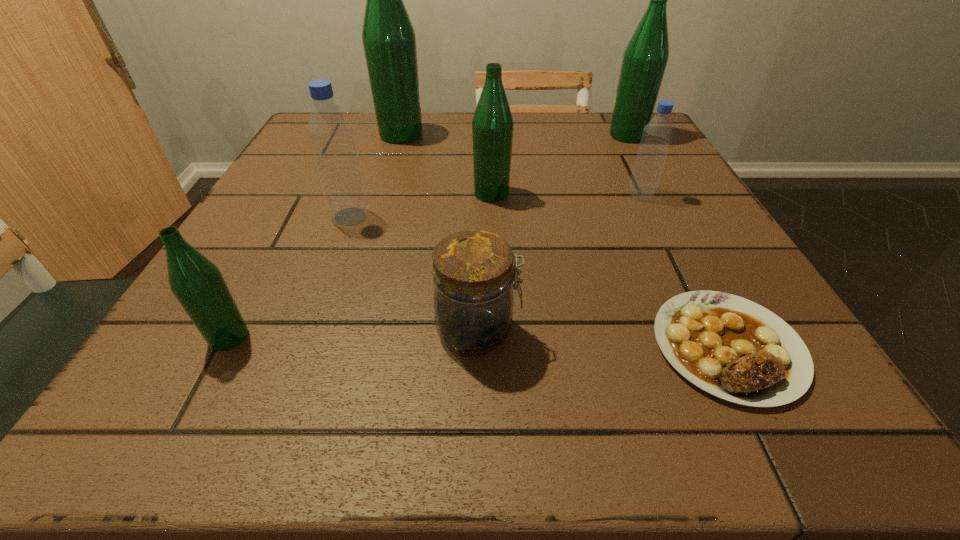
At what (x,y) coordinates should I click in order to perform the action: click on the nearest green bottle. Please return your answer as a coordinate pair (x, y). This screenshot has height=540, width=960. Looking at the image, I should click on (197, 283).

The width and height of the screenshot is (960, 540). Find the location of `the smallest green bottle`. the smallest green bottle is located at coordinates (197, 283).

Find the location of `jar`. jar is located at coordinates (473, 273).

The height and width of the screenshot is (540, 960). Find the location of `the shortest object`. the shortest object is located at coordinates (735, 349).

The height and width of the screenshot is (540, 960). I want to click on blank space located 0.170m on the left of the second green bottle from left to right, so click(x=306, y=135).

Find the location of a particular element. vacant space situated 0.050m on the left of the third smallest green bottle is located at coordinates (587, 136).

The height and width of the screenshot is (540, 960). In order to click on free spot located 0.150m on the left of the second nearest green bottle in this screenshot , I will do pyautogui.click(x=396, y=193).

You are a GUI agent. You are given a task and a screenshot of the screen. Output one action in this format:
    pyautogui.click(x=<x>, y=<y>)
    Task: Click on the vacant space situated on the right of the nearer blue bottle
    Image resolution: width=960 pixels, height=540 pixels.
    Given the screenshot: What is the action you would take?
    pyautogui.click(x=481, y=217)

Find the location of a particular element. Image resolution: width=960 pixels, height=540 pixels. free space located 0.360m on the back of the farther blue bottle is located at coordinates (601, 113).

Identify the location of free region located on the right of the leftmost object. [x=520, y=337].